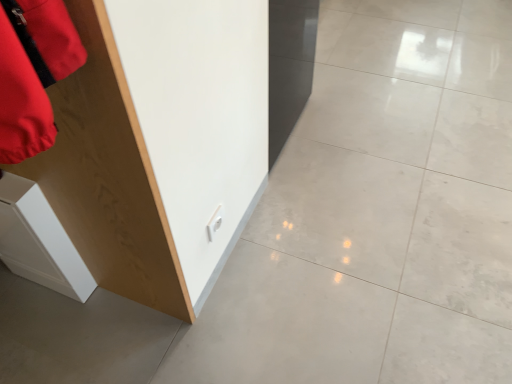
The image size is (512, 384). What do you see at coordinates (159, 143) in the screenshot? I see `wooden cabinet at left` at bounding box center [159, 143].

This screenshot has width=512, height=384. I want to click on white polished concrete at center, so click(378, 214).

In the scene shown: Is white polished concrete at center located outside wooden cabinet at left?

Indeed, white polished concrete at center is completely outside wooden cabinet at left.

Does white polished concrete at center have a greater width compared to wooden cabinet at left?

Correct, the width of white polished concrete at center exceeds that of wooden cabinet at left.

Is white polished concrete at center bigger than wooden cabinet at left?

Indeed, white polished concrete at center has a larger size compared to wooden cabinet at left.

Who is shorter, white polished concrete at center or wooden cabinet at left?

white polished concrete at center.

From the picture: Is white polished concrete at center bigger than white glossy cabinet at lower left?

Indeed, white polished concrete at center has a larger size compared to white glossy cabinet at lower left.

Is white polished concrete at center not inside white glossy cabinet at lower left?

That's correct, white polished concrete at center is outside of white glossy cabinet at lower left.

Based on the photo, considering the sizes of objects white polished concrete at center and white glossy cabinet at lower left in the image provided, who is shorter, white polished concrete at center or white glossy cabinet at lower left?

white polished concrete at center is shorter.

Does white glossy cabinet at lower left have a greater height compared to white polished concrete at center?

Correct, white glossy cabinet at lower left is much taller as white polished concrete at center.

Is white glossy cabinet at lower left positioned with its back to white polished concrete at center?

No, white glossy cabinet at lower left is not facing the opposite direction of white polished concrete at center.

From a real-world perspective, is white glossy cabinet at lower left located beneath white polished concrete at center?

No.

Image resolution: width=512 pixels, height=384 pixels. I want to click on cabinetry lying behind the white polished concrete at center, so click(39, 241).

From the image's perspective, which one is positioned lower, wooden cabinet at left or white polished concrete at center?

From the image's view, wooden cabinet at left is below.

How far apart are wooden cabinet at left and white polished concrete at center?

wooden cabinet at left is 21.54 inches away from white polished concrete at center.

Does wooden cabinet at left have a smaller size compared to white polished concrete at center?

Yes, wooden cabinet at left is smaller than white polished concrete at center.

From the image's perspective, between wooden cabinet at left and white glossy cabinet at lower left, which one is located above?

wooden cabinet at left appears higher in the image.

Which is in front, point (69, 202) or point (28, 222)?

The point (69, 202) is closer.

Can you confirm if wooden cabinet at left is bigger than white glossy cabinet at lower left?

Yes, wooden cabinet at left is bigger than white glossy cabinet at lower left.

Is wooden cabinet at left spatially inside white glossy cabinet at lower left, or outside of it?

wooden cabinet at left lies outside white glossy cabinet at lower left.

From a real-world perspective, is white glossy cabinet at lower left over wooden cabinet at left?

No.

Is white glossy cabinet at lower left at the right side of wooden cabinet at left?

Incorrect, white glossy cabinet at lower left is not on the right side of wooden cabinet at left.

From the image's perspective, between white glossy cabinet at lower left and wooden cabinet at left, who is located below?

white glossy cabinet at lower left, from the image's perspective.

Is white glossy cabinet at lower left not within wooden cabinet at left?

white glossy cabinet at lower left lies outside wooden cabinet at left's area.

In the image, there is a wooden cabinet at left. Identify the location of concrete above it (from the image's perspective). The image size is (512, 384). pyautogui.click(x=378, y=214).

Locate an element on the screen. concrete below the white glossy cabinet at lower left (from a real-world perspective) is located at coordinates (378, 214).

Estimate the real-world distances between objects in this image. Which object is further from white glossy cabinet at lower left, white polished concrete at center or wooden cabinet at left?

white polished concrete at center.

Which object lies nearer to the anchor point wooden cabinet at left, white polished concrete at center or white glossy cabinet at lower left?

white glossy cabinet at lower left is positioned closer to the anchor wooden cabinet at left.

Estimate the real-world distances between objects in this image. Which object is closer to wooden cabinet at left, white glossy cabinet at lower left or white polished concrete at center?

white glossy cabinet at lower left is closer to wooden cabinet at left.

Which object lies nearer to the anchor point white glossy cabinet at lower left, wooden cabinet at left or white polished concrete at center?

wooden cabinet at left lies closer to white glossy cabinet at lower left than the other object.

From the picture: Estimate the real-world distances between objects in this image. Which object is further from white polished concrete at center, white glossy cabinet at lower left or wooden cabinet at left?

white glossy cabinet at lower left lies further to white polished concrete at center than the other object.

From the image, which object appears to be nearer to white polished concrete at center, wooden cabinet at left or white glossy cabinet at lower left?

wooden cabinet at left.

You are a GUI agent. You are given a task and a screenshot of the screen. Output one action in this format:
    pyautogui.click(x=<x>, y=<y>)
    Task: Click on the furniture between white glossy cabinet at lower left and white polished concrete at center
    The width and height of the screenshot is (512, 384).
    Given the screenshot: What is the action you would take?
    pyautogui.click(x=159, y=143)